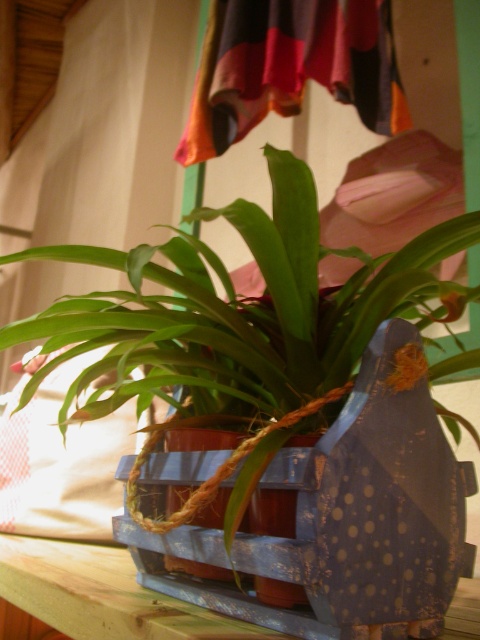
Based on the photo, is green matte plant at center to the right of wooden at lower left from the viewer's perspective?

Yes, green matte plant at center is to the right of wooden at lower left.

This screenshot has height=640, width=480. What do you see at coordinates (240, 330) in the screenshot?
I see `green matte plant at center` at bounding box center [240, 330].

In order to click on green matte plant at center in this screenshot , I will do [240, 330].